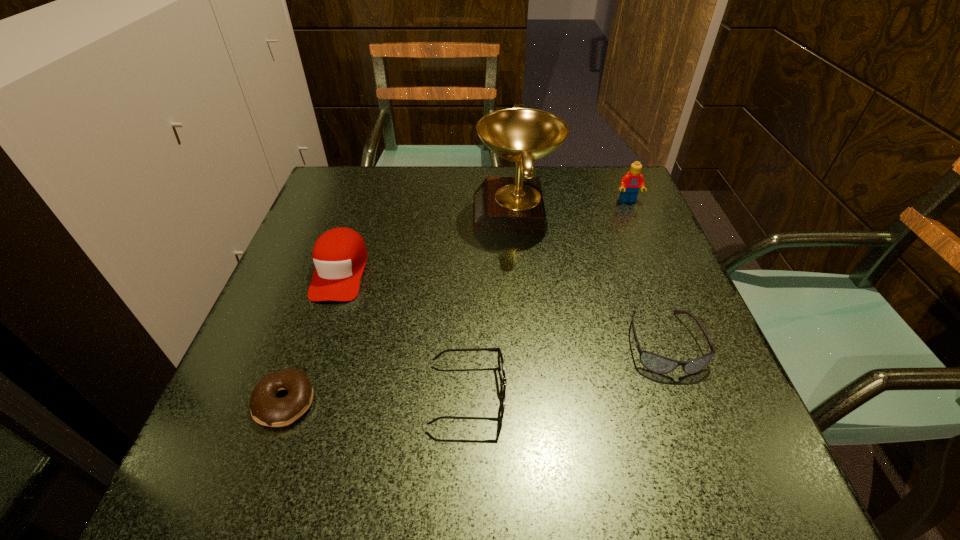
You are a GUI agent. You are given a task and a screenshot of the screen. Output one action in this format:
    pyautogui.click(x=<x>, y=<y>)
    Task: Click on the object situated at the far right corner
    The image size is (960, 540).
    Given the screenshot: What is the action you would take?
    pyautogui.click(x=630, y=184)

Image resolution: width=960 pixels, height=540 pixels. I want to click on vacant space at the far edge, so click(x=424, y=184).

What are the coordinates of `vacant region at the near edge of the desktop` in the screenshot? It's located at (532, 502).

The image size is (960, 540). In order to click on vacant area at the left edge of the desktop in this screenshot , I will do `click(231, 390)`.

Locate an element on the screen. Image resolution: width=960 pixels, height=540 pixels. vacant space at the right edge of the desktop is located at coordinates pos(607,237).

Locate an element on the screen. free spot at the far left corner of the desktop is located at coordinates (375, 181).

This screenshot has width=960, height=540. Identify the location of vacant space at the near left corner. (264, 443).

In the image, there is a desktop. Find the location of `vacant space at the far right corner`. vacant space at the far right corner is located at coordinates (588, 177).

Locate an element on the screen. Image resolution: width=960 pixels, height=540 pixels. unoccupied position between the Lego and the doughnut is located at coordinates (456, 301).

This screenshot has height=540, width=960. What are the coordinates of `vacant region between the Lego and the baseball cap` in the screenshot? It's located at (484, 236).